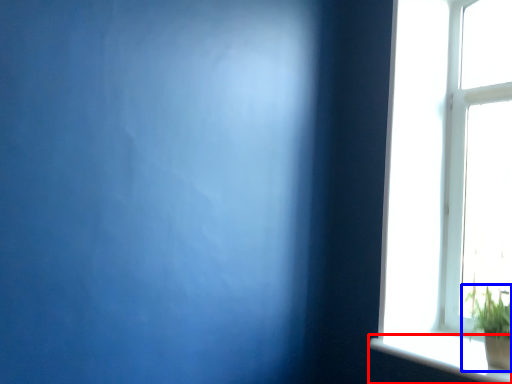
Question: Which object appears closest to the camera in this image, window sill (highlighted by a red box) or houseplant (highlighted by a blue box)?

Choices:
 (A) window sill
 (B) houseplant

Answer: (A)